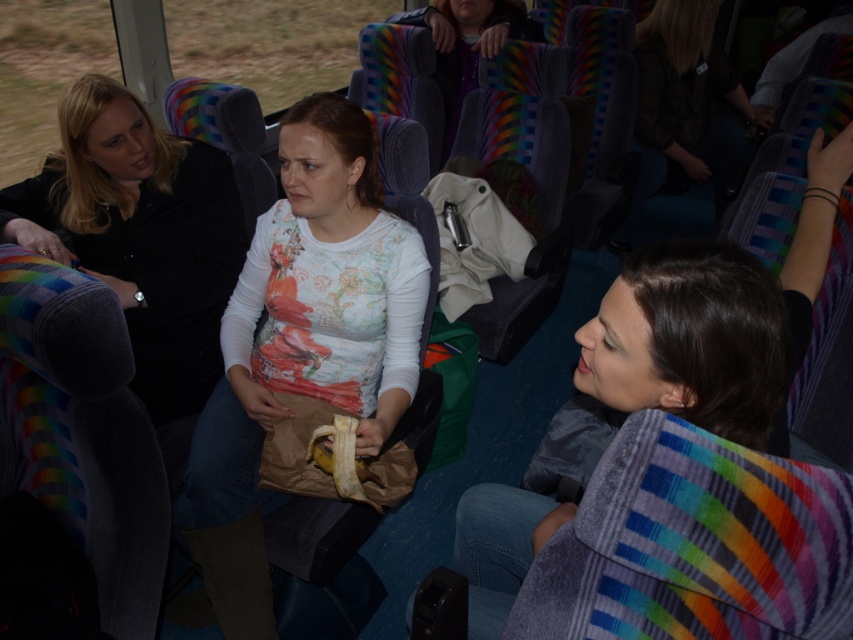
Question: Which of the following is the farthest from the observer?

Choices:
 (A) floral printed shirt at center
 (B) matte gray jacket at center

Answer: (A)

Question: Which object appears closest to the camera in this image?

Choices:
 (A) matte gray jacket at center
 (B) floral printed shirt at center

Answer: (A)

Question: Which object is closer to the camera taking this photo?

Choices:
 (A) matte gray jacket at center
 (B) floral printed shirt at center

Answer: (A)

Question: Does floral printed shirt at center appear under matte gray jacket at center?

Choices:
 (A) yes
 (B) no

Answer: (A)

Question: Does floral printed shirt at center appear over matte gray jacket at center?

Choices:
 (A) no
 (B) yes

Answer: (A)

Question: Is floral printed shirt at center behind matte gray jacket at center?

Choices:
 (A) no
 (B) yes

Answer: (B)